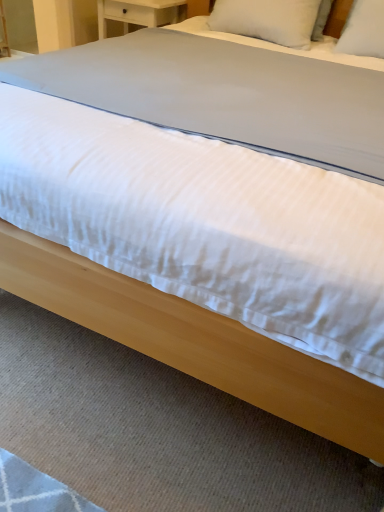
Describe the element at coordinates (272, 20) in the screenshot. I see `white soft pillow at upper center` at that location.

What is the approximate height of white soft pillow at upper center?

The height of white soft pillow at upper center is 8.27 inches.

Where is `white soft pillow at upper center`? The image size is (384, 512). white soft pillow at upper center is located at coordinates [x=272, y=20].

At what (x,y) coordinates should I click in order to perform the action: click on white soft pillow at upper center. Please return your answer as a coordinate pair (x, y). This screenshot has width=384, height=512. Looking at the image, I should click on (272, 20).